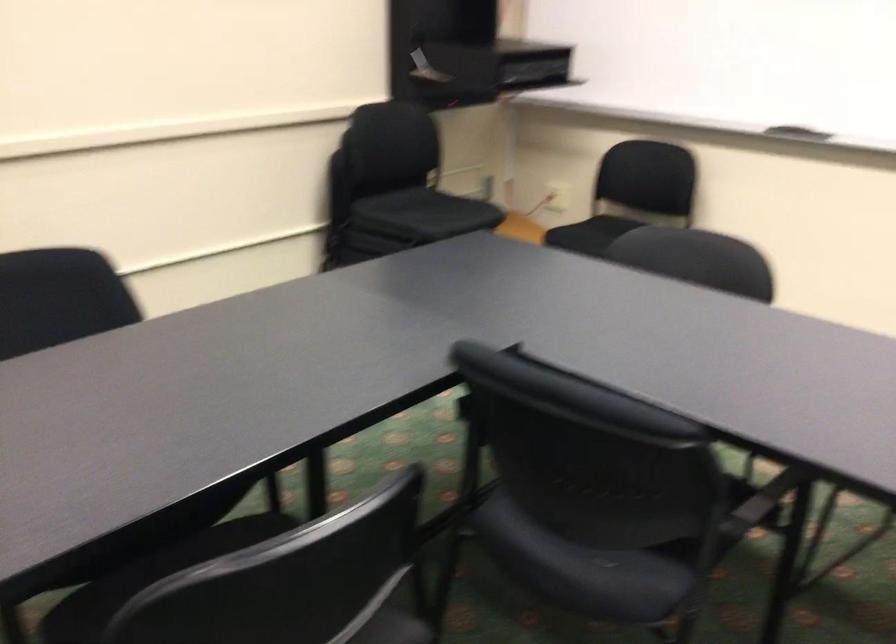
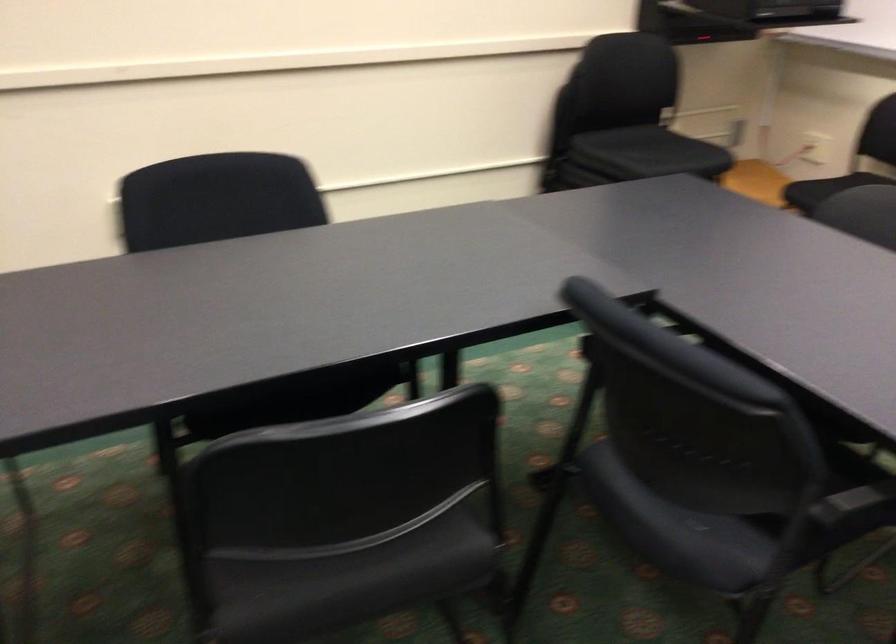
In the second image, find the point that corresponds to [572,560] in the first image.

(666, 515)